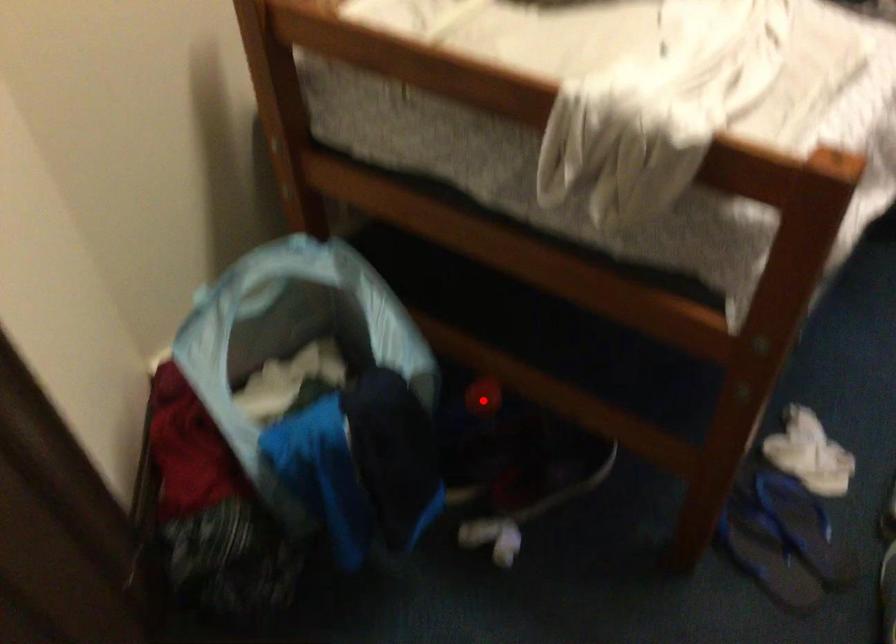
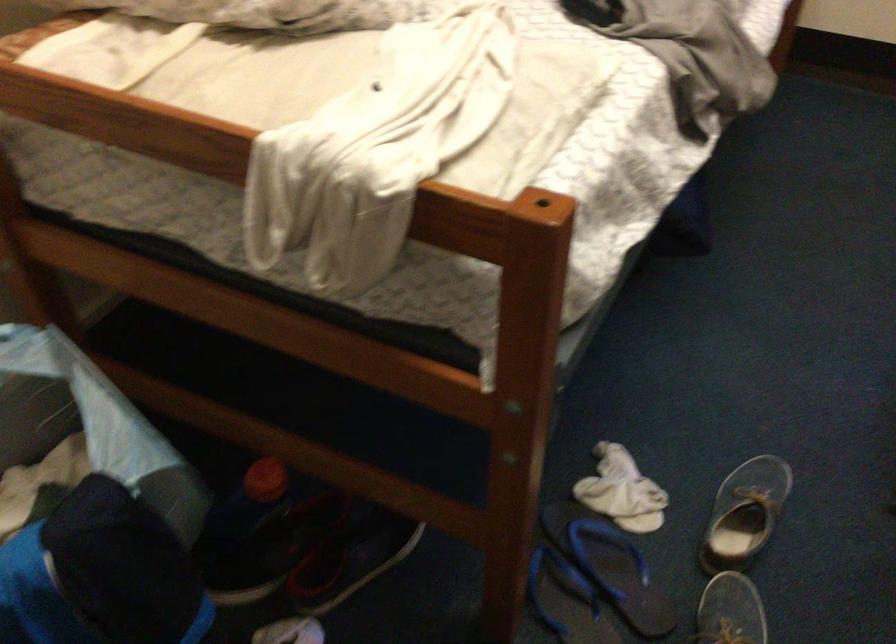
Question: I am providing you with two images of the same scene from different viewpoints. A red point is shown in image1. For the corresponding object point in image2, is it positioned nearer or farther from the camera?

Choices:
 (A) Nearer
 (B) Farther

Answer: (A)